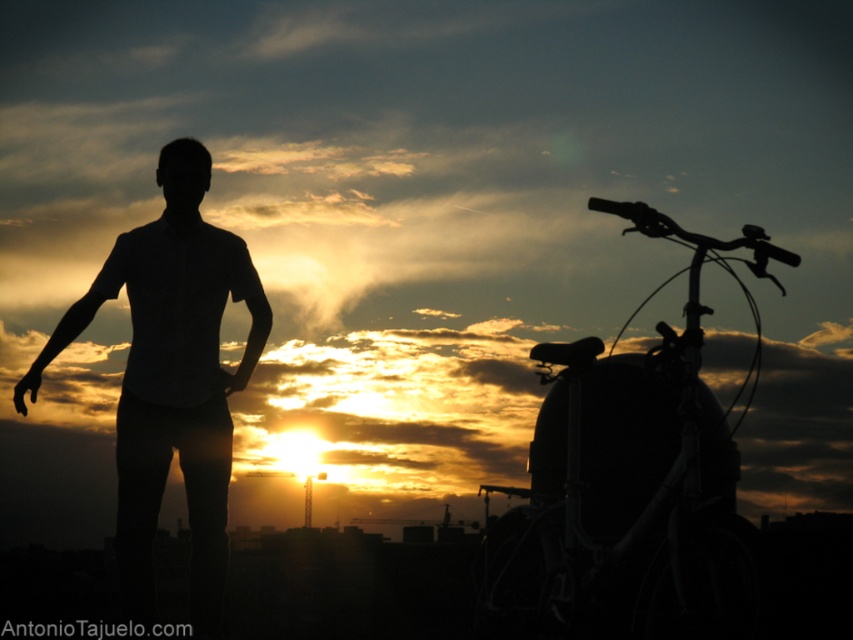
Question: Is silhouette metallic bicycle at right closer to the viewer compared to silhouette figure at center?

Choices:
 (A) no
 (B) yes

Answer: (B)

Question: Does silhouette metallic bicycle at right lie in front of silhouette figure at center?

Choices:
 (A) yes
 (B) no

Answer: (A)

Question: Which of the following is the farthest from the observer?

Choices:
 (A) silhouette metallic bicycle at right
 (B) silhouette figure at center

Answer: (B)

Question: Which point is closer to the camera?

Choices:
 (A) silhouette metallic bicycle at right
 (B) silhouette figure at center

Answer: (A)

Question: Which object is closer to the camera taking this photo?

Choices:
 (A) silhouette metallic bicycle at right
 (B) silhouette figure at center

Answer: (A)

Question: Can you confirm if silhouette metallic bicycle at right is wider than silhouette figure at center?

Choices:
 (A) no
 (B) yes

Answer: (B)